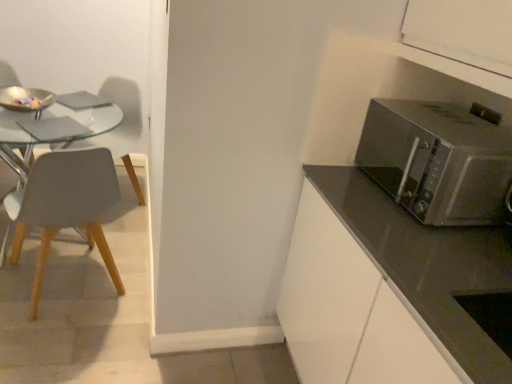
Question: Is there a large distance between satin silver microwave at right and matte gray chair at left, which is counted as the 2th chair, starting from the front?

Choices:
 (A) no
 (B) yes

Answer: (B)

Question: From a real-world perspective, is satin silver microwave at right over matte gray chair at left, which is counted as the 2th chair, starting from the front?

Choices:
 (A) yes
 (B) no

Answer: (A)

Question: Is satin silver microwave at right to the left of matte gray chair at left, placed as the 1th chair when sorted from back to front, from the viewer's perspective?

Choices:
 (A) yes
 (B) no

Answer: (B)

Question: Considering the relative positions of satin silver microwave at right and matte gray chair at left, placed as the 1th chair when sorted from back to front, in the image provided, is satin silver microwave at right behind matte gray chair at left, placed as the 1th chair when sorted from back to front,?

Choices:
 (A) no
 (B) yes

Answer: (A)

Question: Is satin silver microwave at right bigger than matte gray chair at left, placed as the 1th chair when sorted from back to front?

Choices:
 (A) yes
 (B) no

Answer: (B)

Question: Can you confirm if satin silver microwave at right is wider than matte gray chair at left, placed as the 1th chair when sorted from back to front?

Choices:
 (A) yes
 (B) no

Answer: (B)

Question: Is matte gray chair at left, the 2th chair viewed from the back, positioned before matte gray chair at left, placed as the 1th chair when sorted from back to front?

Choices:
 (A) yes
 (B) no

Answer: (A)

Question: Is matte gray chair at left, the 2th chair viewed from the back, to the right of matte gray chair at left, placed as the 1th chair when sorted from back to front, from the viewer's perspective?

Choices:
 (A) yes
 (B) no

Answer: (A)

Question: From the image's perspective, is matte gray chair at left, the 2th chair viewed from the back, under matte gray chair at left, which is counted as the 2th chair, starting from the front?

Choices:
 (A) yes
 (B) no

Answer: (A)

Question: Considering the relative sizes of matte gray chair at left, which appears as the 1th chair when viewed from the front, and matte gray chair at left, which is counted as the 2th chair, starting from the front, in the image provided, is matte gray chair at left, which appears as the 1th chair when viewed from the front, shorter than matte gray chair at left, which is counted as the 2th chair, starting from the front,?

Choices:
 (A) no
 (B) yes

Answer: (B)

Question: Could you tell me if matte gray chair at left, which appears as the 1th chair when viewed from the front, is facing matte gray chair at left, placed as the 1th chair when sorted from back to front?

Choices:
 (A) yes
 (B) no

Answer: (A)

Question: Is matte gray chair at left, the 2th chair viewed from the back, far from matte gray chair at left, placed as the 1th chair when sorted from back to front?

Choices:
 (A) yes
 (B) no

Answer: (B)

Question: Does matte gray chair at left, which appears as the 1th chair when viewed from the front, lie behind satin silver microwave at right?

Choices:
 (A) yes
 (B) no

Answer: (A)